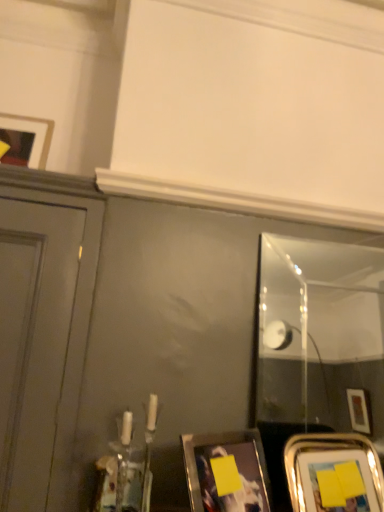
Question: Is matte black picture frame at upper left, the third picture frame positioned from the right, further to camera compared to metallic silver picture frame at lower right, placed as the third picture frame when sorted from left to right?

Choices:
 (A) yes
 (B) no

Answer: (A)

Question: Is matte black picture frame at upper left, which appears as the 1th picture frame when viewed from the top, completely or partially outside of metallic silver picture frame at lower right, the first picture frame in the right-to-left sequence?

Choices:
 (A) no
 (B) yes

Answer: (B)

Question: From a real-world perspective, is matte black picture frame at upper left, which is the 3th picture frame from bottom to top, over metallic silver picture frame at lower right, arranged as the 3th picture frame when viewed from the top?

Choices:
 (A) yes
 (B) no

Answer: (A)

Question: Considering the relative positions of matte black picture frame at upper left, placed as the first picture frame when sorted from left to right, and metallic silver picture frame at lower right, arranged as the 3th picture frame when viewed from the top, in the image provided, is matte black picture frame at upper left, placed as the first picture frame when sorted from left to right, to the left of metallic silver picture frame at lower right, arranged as the 3th picture frame when viewed from the top, from the viewer's perspective?

Choices:
 (A) no
 (B) yes

Answer: (B)

Question: Does matte black picture frame at upper left, placed as the first picture frame when sorted from left to right, come in front of metallic silver picture frame at lower right, the first picture frame in the right-to-left sequence?

Choices:
 (A) yes
 (B) no

Answer: (B)

Question: Is matte black picture frame at upper left, which appears as the 1th picture frame when viewed from the top, turned away from metallic silver picture frame at lower right, the first picture frame in the right-to-left sequence?

Choices:
 (A) no
 (B) yes

Answer: (A)

Question: Does matte black picture frame at upper left, which appears as the 1th picture frame when viewed from the top, come behind yellow matte picture frame at lower center, arranged as the second picture frame when viewed from the right?

Choices:
 (A) no
 (B) yes

Answer: (B)

Question: Considering the relative sizes of matte black picture frame at upper left, placed as the first picture frame when sorted from left to right, and yellow matte picture frame at lower center, positioned as the 2th picture frame in left-to-right order, in the image provided, is matte black picture frame at upper left, placed as the first picture frame when sorted from left to right, smaller than yellow matte picture frame at lower center, positioned as the 2th picture frame in left-to-right order,?

Choices:
 (A) no
 (B) yes

Answer: (B)

Question: Is matte black picture frame at upper left, the third picture frame positioned from the right, far away from yellow matte picture frame at lower center, arranged as the second picture frame when viewed from the right?

Choices:
 (A) yes
 (B) no

Answer: (B)

Question: Does matte black picture frame at upper left, placed as the first picture frame when sorted from left to right, have a greater height compared to yellow matte picture frame at lower center, arranged as the second picture frame when viewed from the right?

Choices:
 (A) no
 (B) yes

Answer: (A)

Question: Is the surface of matte black picture frame at upper left, the third picture frame positioned from the right, in direct contact with yellow matte picture frame at lower center, placed as the second picture frame when sorted from bottom to top?

Choices:
 (A) no
 (B) yes

Answer: (A)

Question: From the image's perspective, is matte black picture frame at upper left, the third picture frame positioned from the right, located beneath yellow matte picture frame at lower center, arranged as the second picture frame when viewed from the right?

Choices:
 (A) yes
 (B) no

Answer: (B)

Question: Does matte black picture frame at upper left, the third picture frame positioned from the right, appear on the right side of clear glass mirror at right?

Choices:
 (A) no
 (B) yes

Answer: (A)